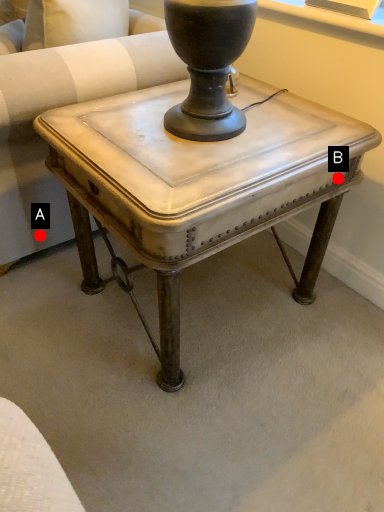
Question: Two points are circled on the image, labeled by A and B beside each circle. Which point is closer to the camera taking this photo?

Choices:
 (A) A is closer
 (B) B is closer

Answer: (B)